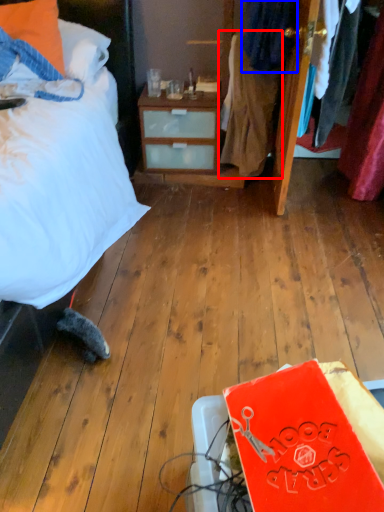
Question: Which point is further to the camera, clothing (highlighted by a red box) or clothing (highlighted by a blue box)?

Choices:
 (A) clothing
 (B) clothing

Answer: (A)